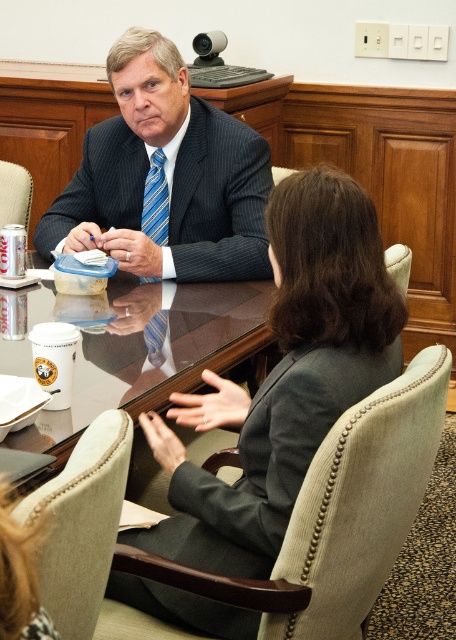
Question: Which object is closer to the camera taking this photo?

Choices:
 (A) blue striped tie at center
 (B) dark gray fabric business suit at center
 (C) dark blue pinstripe suit at center

Answer: (B)

Question: Is the position of dark blue pinstripe suit at center less distant than that of blue striped tie at center?

Choices:
 (A) yes
 (B) no

Answer: (A)

Question: Among these points, which one is nearest to the camera?

Choices:
 (A) (249, 216)
 (B) (162, 528)
 (C) (30, 449)

Answer: (C)

Question: Which point is closer to the camera?

Choices:
 (A) (161, 212)
 (B) (67, 196)
 (C) (188, 497)
 (D) (107, 371)

Answer: (C)

Question: Where is dark blue pinstripe suit at center located in relation to blue striped tie at center in the image?

Choices:
 (A) left
 (B) right

Answer: (A)

Question: Does glossy wood round table at center have a larger size compared to blue striped tie at center?

Choices:
 (A) no
 (B) yes

Answer: (B)